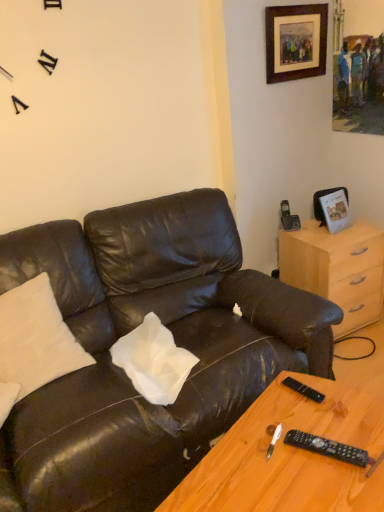
Where is `free space to the left of metallic silver photo frame at upper right, the second picture frame in the top-to-bottom sequence`? Image resolution: width=384 pixels, height=512 pixels. free space to the left of metallic silver photo frame at upper right, the second picture frame in the top-to-bottom sequence is located at coordinates (312, 237).